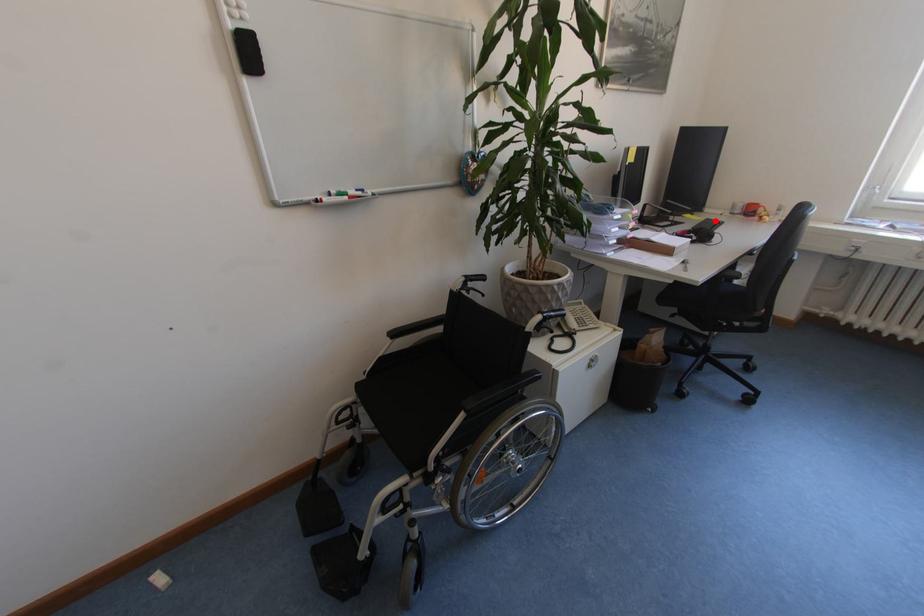
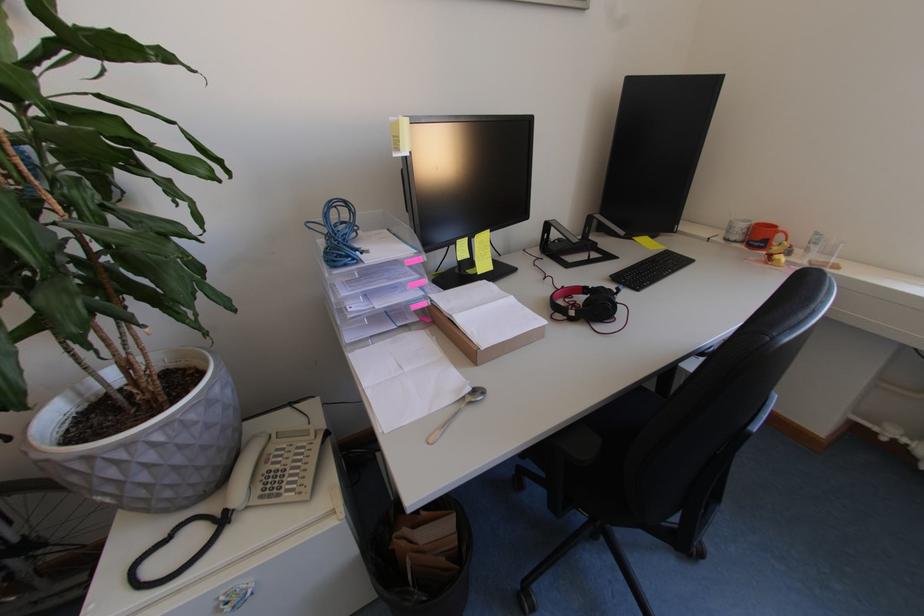
Locate, in the second image, the point that corresponds to the highlighted location in the first image.

(674, 254)